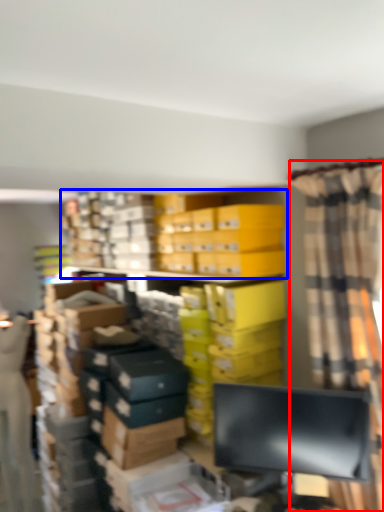
Question: Which object is closer to the camera taking this photo, curtain (highlighted by a red box) or bookcase (highlighted by a blue box)?

Choices:
 (A) curtain
 (B) bookcase

Answer: (A)